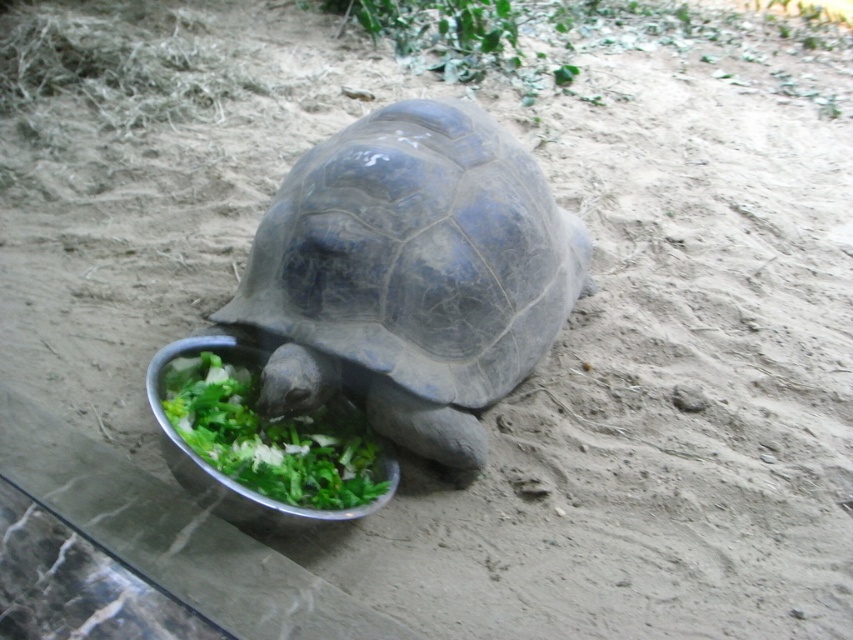
Does smooth gray tortoise at center have a lesser width compared to metallic silver bowl at lower center?

Incorrect, smooth gray tortoise at center's width is not less than metallic silver bowl at lower center's.

This screenshot has height=640, width=853. Describe the element at coordinates (410, 275) in the screenshot. I see `smooth gray tortoise at center` at that location.

Identify the location of smooth gray tortoise at center. Image resolution: width=853 pixels, height=640 pixels. (410, 275).